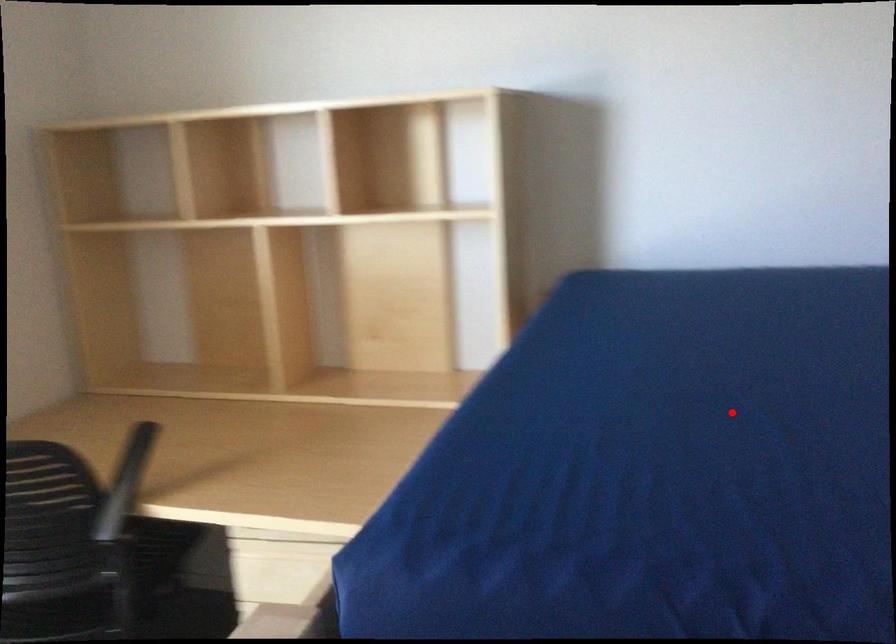
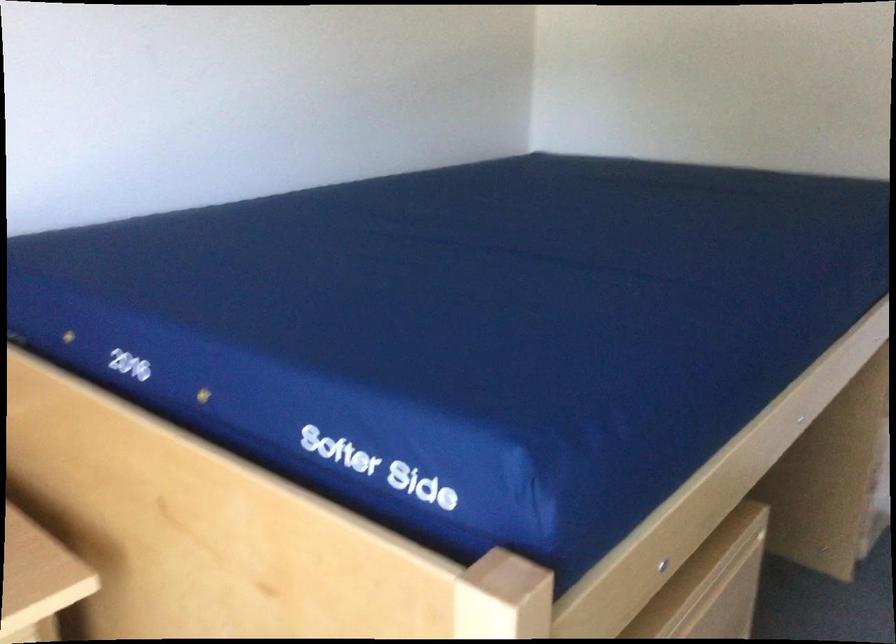
Question: I am providing you with two images of the same scene from different viewpoints. Image1 has a red point marked. In image2, the corresponding 3D location appears at what relative position? Reply with the corresponding letter.

Choices:
 (A) Closer
 (B) Farther

Answer: (B)